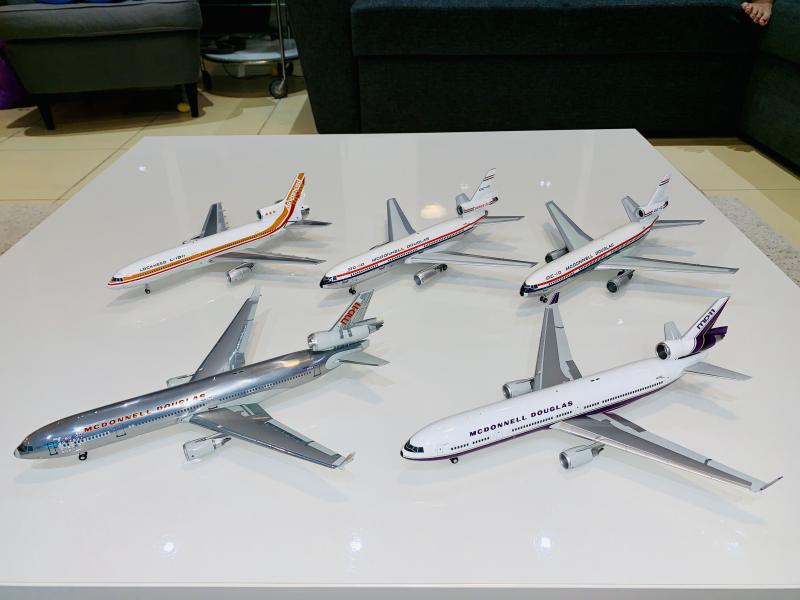
Find the location of `floor`. floor is located at coordinates (56, 135), (744, 172).